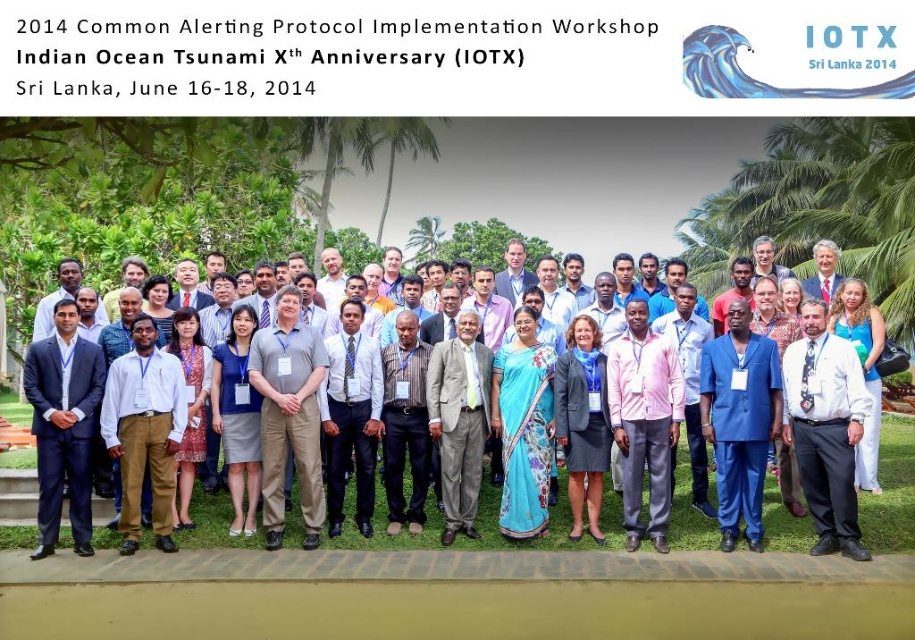
Question: Which point is farther to the camera?

Choices:
 (A) white cotton shirt at center
 (B) blue suit at center
 (C) matte white shirt at center
 (D) pink fabric shirt at center

Answer: (C)

Question: Where is dark blue suit at center located in relation to blue fabric dress at center in the image?

Choices:
 (A) left
 (B) right

Answer: (A)

Question: Which object is positioned closest to the matte khaki pants at center?

Choices:
 (A) gray wool suit at center
 (B) dark blue suit at center

Answer: (B)

Question: Which object appears farthest from the camera in this image?

Choices:
 (A) blue fabric dress at center
 (B) dark blue suit at center
 (C) matte white shirt at center
 (D) white shirt at center

Answer: (A)

Question: Is dark blue suit at center thinner than gray wool suit at center?

Choices:
 (A) yes
 (B) no

Answer: (B)

Question: Is white shirt at center below matte white shirt at center?

Choices:
 (A) yes
 (B) no

Answer: (B)